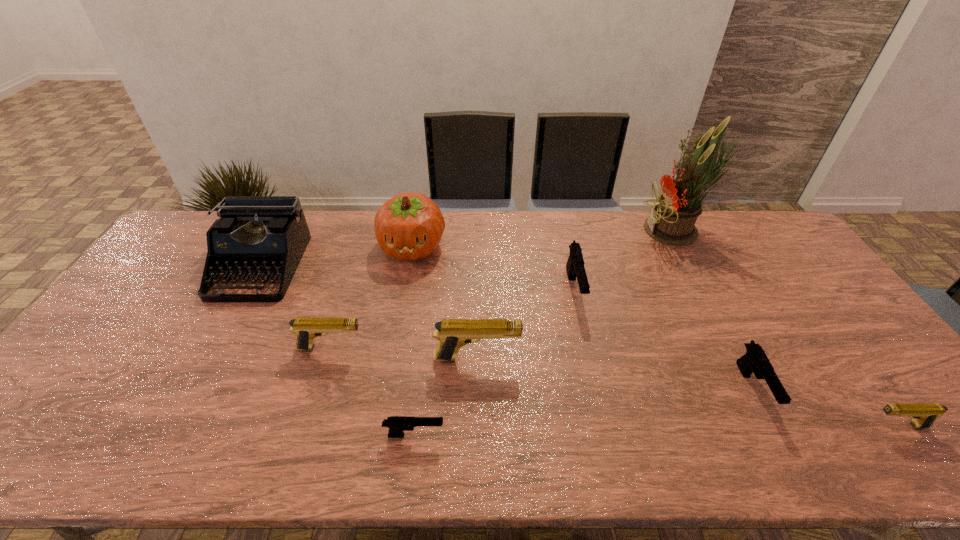
In order to click on the fifth nearest pistol in this screenshot , I will do `click(306, 329)`.

This screenshot has height=540, width=960. I want to click on the rightmost black pistol, so click(755, 360).

Identify the location of the second smallest black pistol. (755, 360).

The image size is (960, 540). I want to click on the rightmost tan pistol, so [924, 415].

Image resolution: width=960 pixels, height=540 pixels. Find the location of `the second nearest object`. the second nearest object is located at coordinates (924, 415).

This screenshot has width=960, height=540. I want to click on the leftmost black pistol, so click(397, 424).

The height and width of the screenshot is (540, 960). In order to click on the nearest black pistol in this screenshot , I will do `click(397, 424)`.

Locate an element on the screen. The image size is (960, 540). vacant space located in front of the tallest object with the fan visible is located at coordinates (553, 231).

The image size is (960, 540). Identify the location of free space located 0.200m in front of the tallest object with the fan visible. (584, 231).

The image size is (960, 540). I want to click on free spot located in front of the tallest object with the fan visible, so click(x=589, y=231).